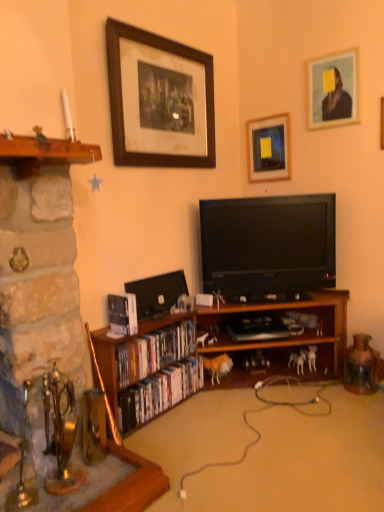
Question: Is hardcover book at lower left, which is the first book in top-to-bottom order, positioned with its back to matte plastic dvds at lower left, placed as the first book when sorted from bottom to top?

Choices:
 (A) yes
 (B) no

Answer: (B)

Question: From the image's perspective, is hardcover book at lower left, which is the first book in top-to-bottom order, above matte plastic dvds at lower left, placed as the first book when sorted from bottom to top?

Choices:
 (A) yes
 (B) no

Answer: (A)

Question: Is hardcover book at lower left, the 3th book ordered from the bottom, smaller than matte plastic dvds at lower left, placed as the first book when sorted from bottom to top?

Choices:
 (A) no
 (B) yes

Answer: (B)

Question: Is hardcover book at lower left, which is the first book in top-to-bottom order, bigger than matte plastic dvds at lower left, marked as the third book in a top-to-bottom arrangement?

Choices:
 (A) yes
 (B) no

Answer: (B)

Question: Would you say hardcover book at lower left, the 3th book ordered from the bottom, contains matte plastic dvds at lower left, marked as the third book in a top-to-bottom arrangement?

Choices:
 (A) yes
 (B) no

Answer: (B)

Question: Is wooden framed print at upper center, the 3th picture frame in the right-to-left sequence, wider or thinner than matte plastic dvds at lower left, marked as the third book in a top-to-bottom arrangement?

Choices:
 (A) wide
 (B) thin

Answer: (B)

Question: From their relative heights in the image, would you say wooden framed print at upper center, the 3th picture frame in the right-to-left sequence, is taller or shorter than matte plastic dvds at lower left, marked as the third book in a top-to-bottom arrangement?

Choices:
 (A) tall
 (B) short

Answer: (A)

Question: From the image's perspective, relative to matte plastic dvds at lower left, marked as the third book in a top-to-bottom arrangement, is wooden framed print at upper center, the 3th picture frame in the right-to-left sequence, above or below?

Choices:
 (A) above
 (B) below

Answer: (A)

Question: Is wooden framed print at upper center, acting as the 1th picture frame starting from the left, inside or outside of matte plastic dvds at lower left, placed as the first book when sorted from bottom to top?

Choices:
 (A) outside
 (B) inside

Answer: (A)

Question: In terms of size, does wooden framed print at upper center, acting as the 1th picture frame starting from the left, appear bigger or smaller than rusty metal jug at lower right?

Choices:
 (A) small
 (B) big

Answer: (B)

Question: Considering their positions, is wooden framed print at upper center, the 3th picture frame in the right-to-left sequence, located in front of or behind rusty metal jug at lower right?

Choices:
 (A) front
 (B) behind

Answer: (A)

Question: In terms of width, does wooden framed print at upper center, the 3th picture frame in the right-to-left sequence, look wider or thinner when compared to rusty metal jug at lower right?

Choices:
 (A) thin
 (B) wide

Answer: (A)

Question: From the image's perspective, relative to rusty metal jug at lower right, is wooden framed print at upper center, acting as the 1th picture frame starting from the left, above or below?

Choices:
 (A) above
 (B) below

Answer: (A)

Question: Would you say wooden picture frame at upper right, the first picture frame in the right-to-left sequence, is to the left or to the right of stone fireplace at left in the picture?

Choices:
 (A) right
 (B) left

Answer: (A)

Question: From a real-world perspective, is wooden picture frame at upper right, the first picture frame in the right-to-left sequence, above or below stone fireplace at left?

Choices:
 (A) above
 (B) below

Answer: (A)